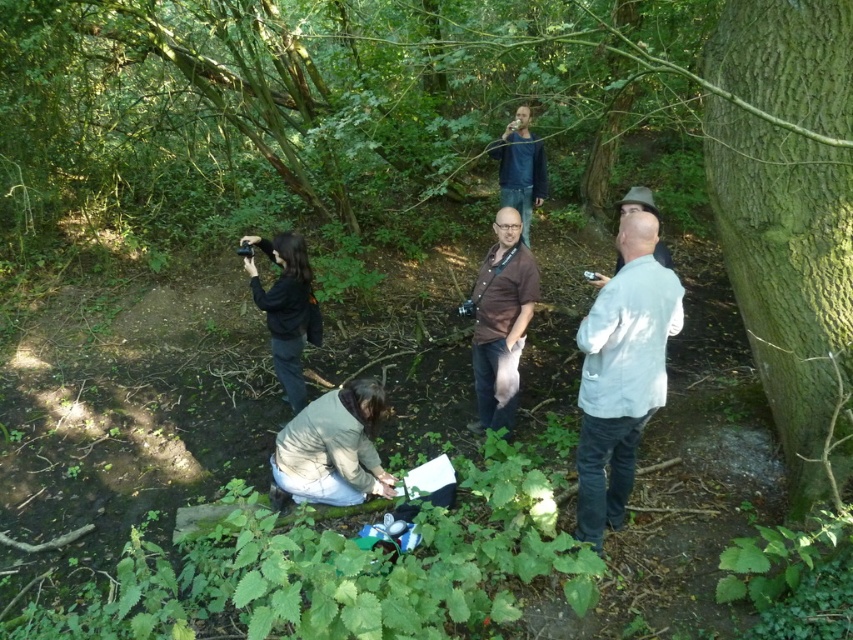
You are a photographer trying to capture a clear shot of the brown fabric shirt at center without the blue denim jeans at upper center blocking it. Can you adjust your angle to do so?

The blue denim jeans at upper center is positioned over brown fabric shirt at center, so adjusting your angle downward might allow you to capture the brown fabric shirt at center without obstruction.

You are standing at the point marked by the coordinate point at point [520,168]. Which object is directly below you?

The point at [520,168] is on blue denim jeans at upper center, so the blue denim jeans at upper center is directly below you.

You are a photographer positioned at the camera location. You want to take a photo that includes both point (776,275) and point (526,310). Which point will appear closer to the edge of the photo frame?

Point (776,275) will appear closer to the edge of the photo frame because it is closer to the camera than point (526,310).